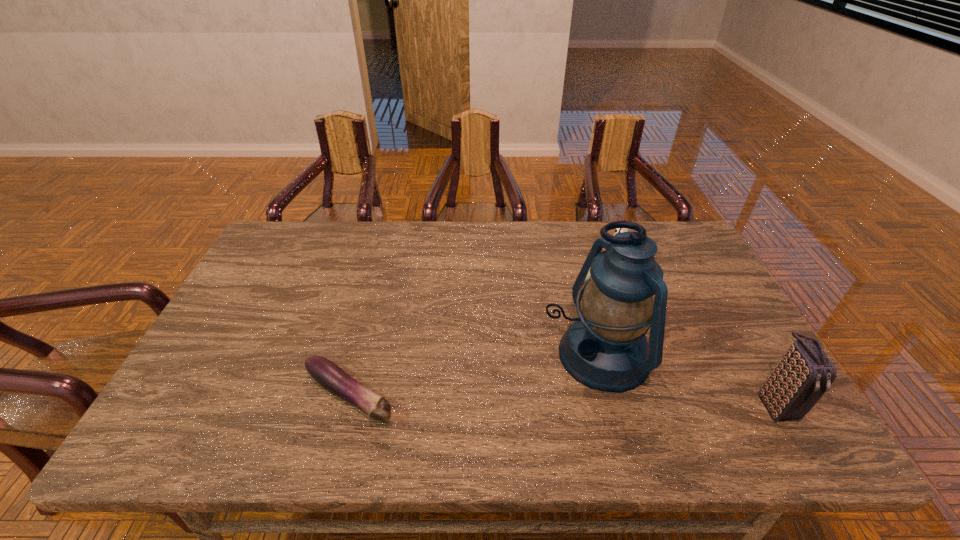
Where is `vacant area at the left edge`? vacant area at the left edge is located at coordinates (276, 321).

Locate an element on the screen. free space at the right edge is located at coordinates 681,299.

This screenshot has width=960, height=540. What are the coordinates of `vacant space at the far left corner of the desktop` in the screenshot? It's located at (314, 244).

Find the location of a particular element. The image size is (960, 540). free space at the near right corner of the desktop is located at coordinates (750, 389).

I want to click on vacant area that lies between the eggplant and the tallest object, so click(x=473, y=376).

Identify the location of vacant area that lies between the eggplant and the rightmost object. (563, 401).

The image size is (960, 540). In order to click on vacant area that lies between the leftmost object and the rightmost object in this screenshot , I will do `click(563, 401)`.

Where is `vacant area between the eggplant and the clutch bag`? This screenshot has width=960, height=540. vacant area between the eggplant and the clutch bag is located at coordinates (563, 401).

Image resolution: width=960 pixels, height=540 pixels. I want to click on free space between the tallest object and the leftmost object, so click(x=473, y=376).

Locate an element on the screen. This screenshot has width=960, height=540. free area in between the leftmost object and the bird is located at coordinates (486, 328).